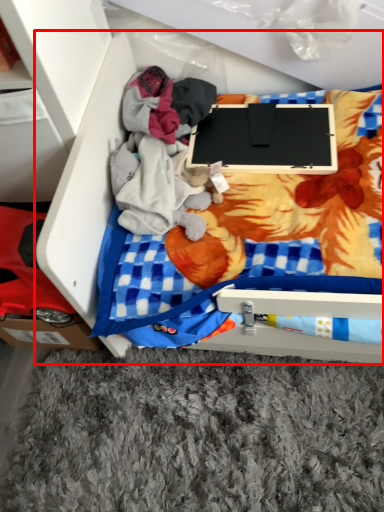
Question: From the image's perspective, what is the correct spatial positioning of furniture (annotated by the red box) in reference to laptop?

Choices:
 (A) above
 (B) below

Answer: (B)